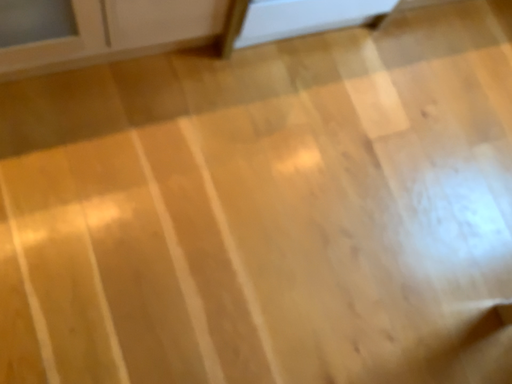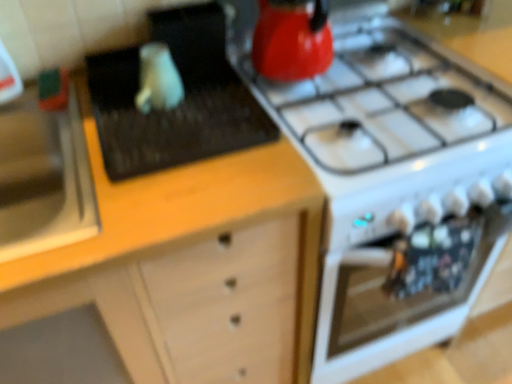
Question: How did the camera likely rotate when shooting the video?

Choices:
 (A) rotated right
 (B) rotated left

Answer: (B)